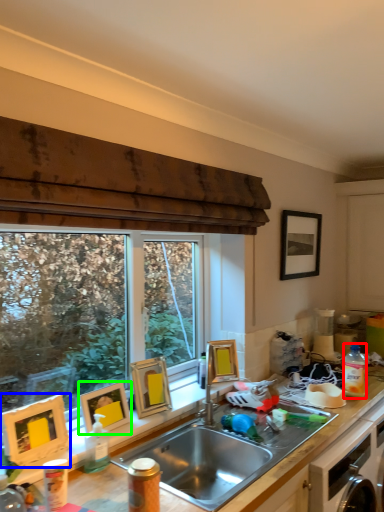
Question: Estimate the real-world distances between objects in this image. Which object is closer to bottle (highlighted by a red box), picture frame (highlighted by a blue box) or picture frame (highlighted by a green box)?

Choices:
 (A) picture frame
 (B) picture frame

Answer: (B)